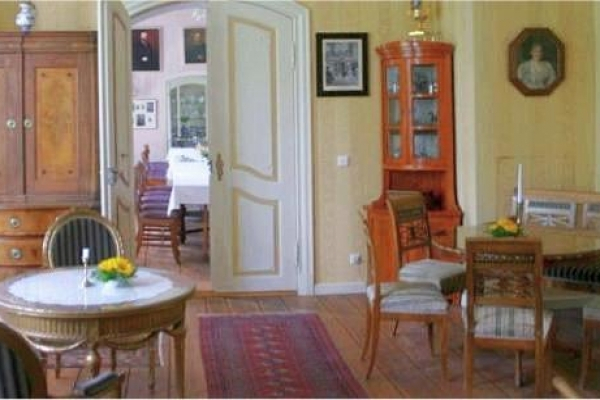
Find the location of `wall`. wall is located at coordinates tap(562, 126), tap(366, 132), tap(151, 90).